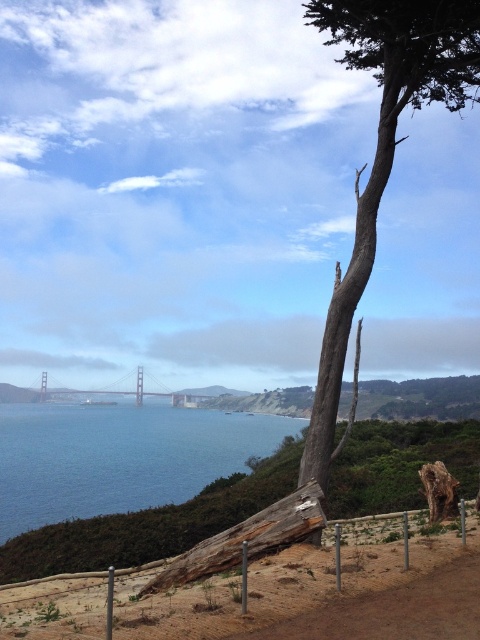
You are standing at the lower center of the scene and want to reach the brown wooden fence at lower center. Considering the coordinates provided in the Objects Description, what direction should you move to reach it?

The brown wooden fence at lower center is already at your current position since you are standing at the lower center of the scene, which matches the fence location at coordinates point (x=286, y=579).

You are standing at the point marked by the coordinates point (384,147). Looking around, you see the smooth gray bark tree at upper right. Which direction should you face to look towards the tree?

The point (384,147) marks the smooth gray bark tree at upper right, so you are already facing the tree. No need to change direction.